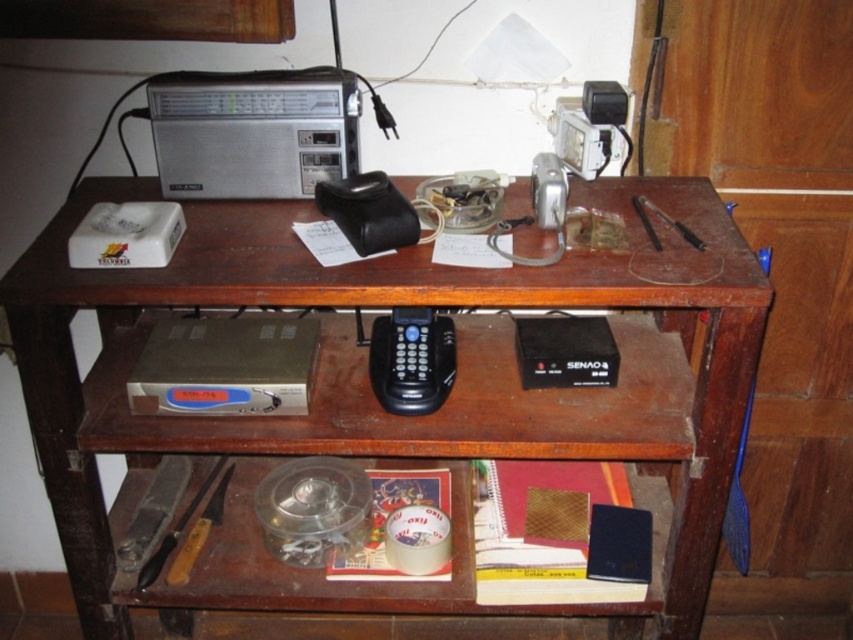
You are organizing the shelf and need to place a new item between the black plastic phone at center and the metallic pen at upper center. Is there space between them?

The black plastic phone at center is positioned under the metallic pen at upper center, so there is vertical space between them for placing a new item.

You are organizing a workspace and need to place a metallic pen at upper center on the brown wooden table at center. Is the pen currently positioned to the left or right of the table?

The metallic pen at upper center is to the right of the brown wooden table at center because the table is to the left of the pen according to the description.

You are organizing the items on the wooden shelf unit. You need to place a new item between the black plastic phone at center and the metallic pen at upper center. Is there enough space between them to fit a 5 cm wide item?

The black plastic phone at center is positioned on the left side of metallic pen at upper center. Since the phone is to the left of the pen, there is space between them. A 5 cm wide item can fit between the black plastic phone at center and the metallic pen at upper center.